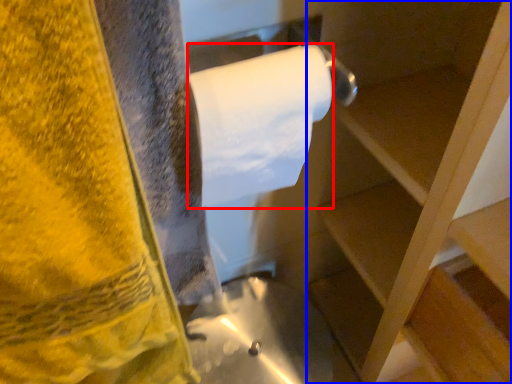
Question: Among these objects, which one is nearest to the camera, toilet paper (highlighted by a red box) or shelf (highlighted by a blue box)?

Choices:
 (A) toilet paper
 (B) shelf

Answer: (B)